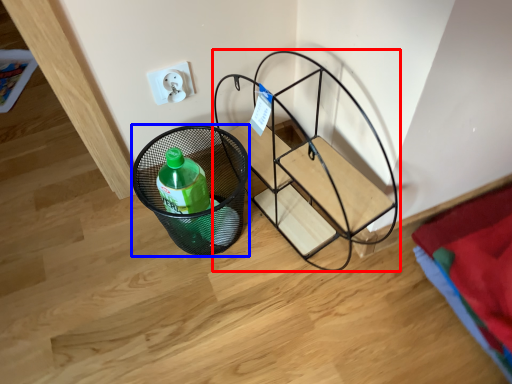
Question: Which point is further to the camera, furniture (highlighted by a red box) or basket (highlighted by a blue box)?

Choices:
 (A) furniture
 (B) basket

Answer: (B)